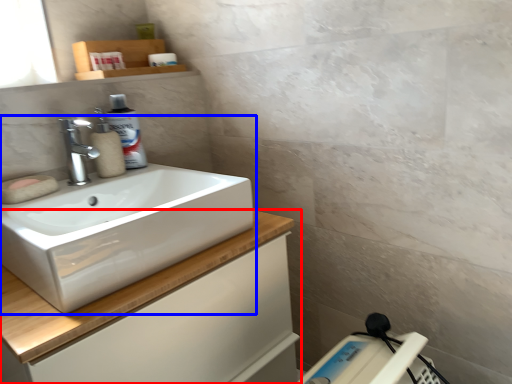
Question: Which point is further to the camera, bathroom cabinet (highlighted by a red box) or sink (highlighted by a blue box)?

Choices:
 (A) bathroom cabinet
 (B) sink

Answer: (B)